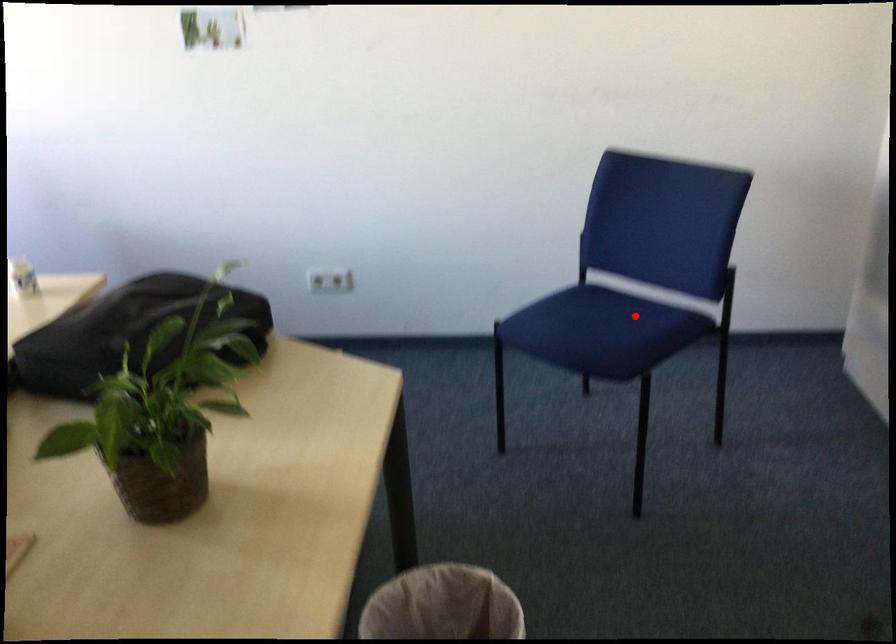
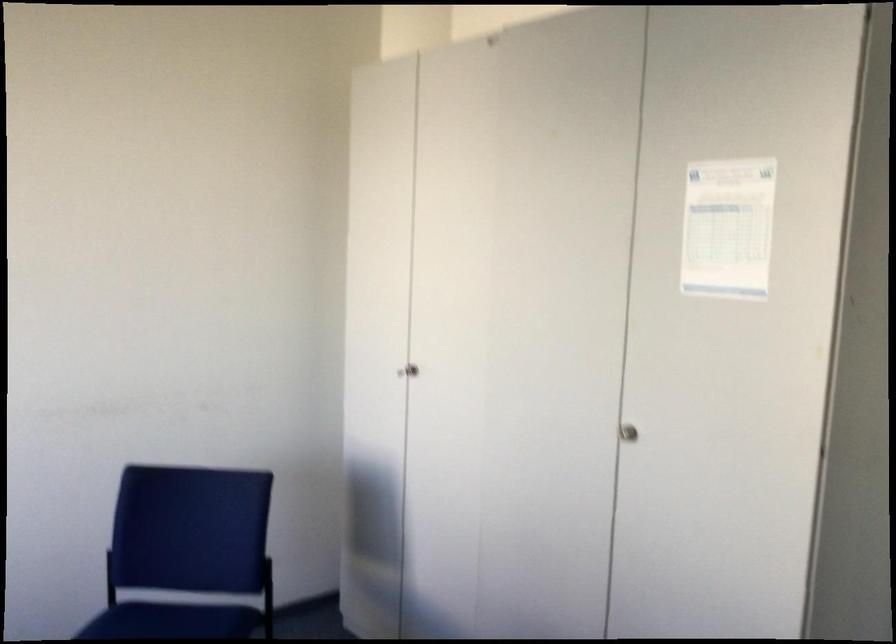
In the second image, find the point that corresponds to the highlighted location in the first image.

(179, 623)